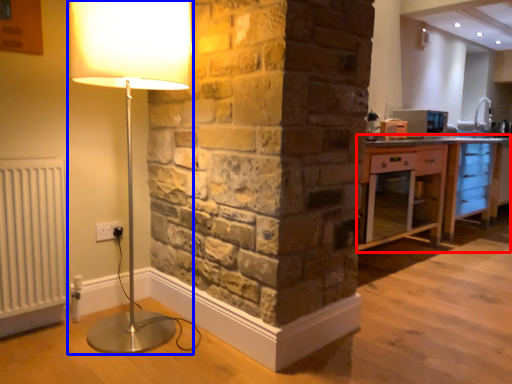
Question: Which object appears farthest to the camera in this image, cabinetry (highlighted by a red box) or lamp (highlighted by a blue box)?

Choices:
 (A) cabinetry
 (B) lamp

Answer: (A)